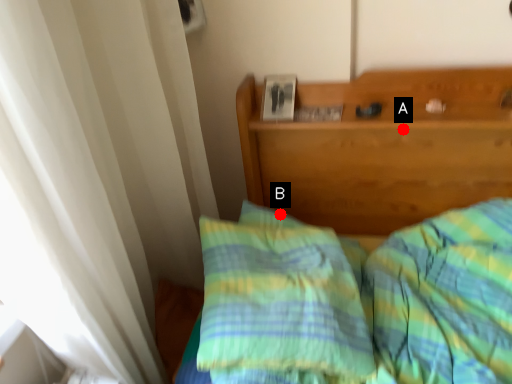
Question: Two points are circled on the image, labeled by A and B beside each circle. Which of the following is the closest to the observer?

Choices:
 (A) A is closer
 (B) B is closer

Answer: (A)